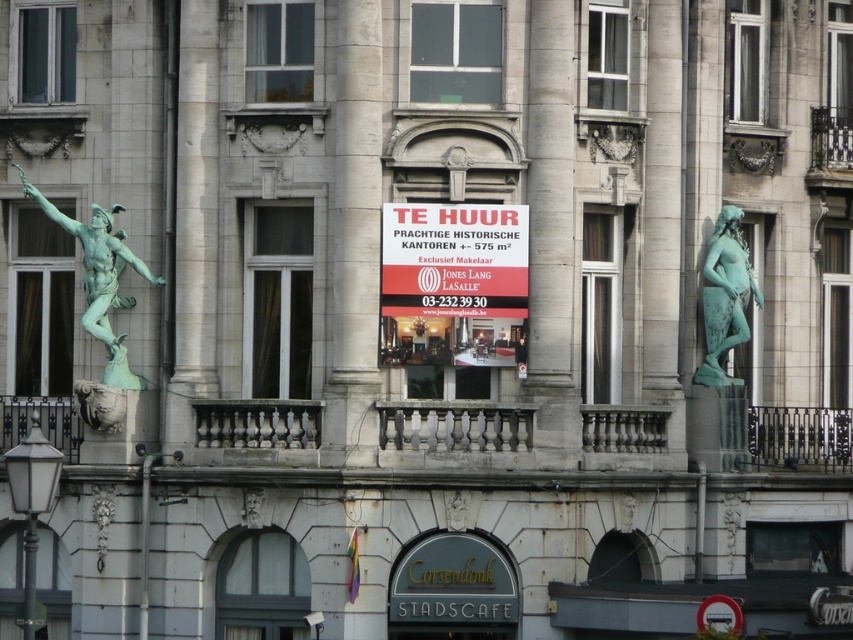
Is point (758, 296) positioned behind point (711, 621)?

Yes, it is.

Does green patina statue at right appear over metallic circular sign at lower right?

Correct, green patina statue at right is located above metallic circular sign at lower right.

Is point (712, 296) less distant than point (711, 596)?

No, (712, 296) is behind (711, 596).

Where is `green patina statue at right`? green patina statue at right is located at coordinates (724, 298).

Is red plastic sign at center positioned in front of green patina statue at right?

That is True.

What do you see at coordinates (454, 259) in the screenshot? I see `red plastic sign at center` at bounding box center [454, 259].

You are a GUI agent. You are given a task and a screenshot of the screen. Output one action in this format:
    pyautogui.click(x=<x>, y=<y>)
    Task: Click on the red plastic sign at center
    
    Given the screenshot: What is the action you would take?
    pyautogui.click(x=454, y=259)

Can you confirm if red plastic sign at center is wider than metallic circular sign at lower right?

Yes, red plastic sign at center is wider than metallic circular sign at lower right.

Does red plastic sign at center appear on the left side of metallic circular sign at lower right?

Correct, you'll find red plastic sign at center to the left of metallic circular sign at lower right.

Who is more forward, (463, 244) or (700, 611)?

Point (700, 611) is in front.

The height and width of the screenshot is (640, 853). In order to click on red plastic sign at center in this screenshot , I will do `click(454, 259)`.